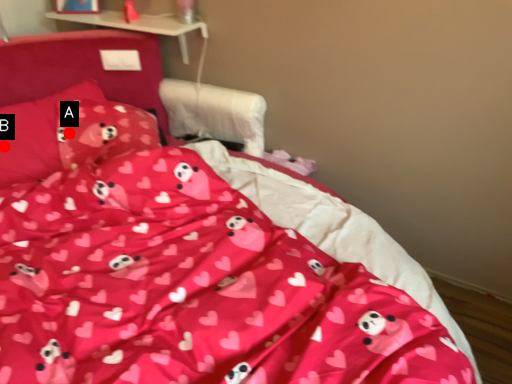
Question: Two points are circled on the image, labeled by A and B beside each circle. Among these points, which one is farthest from the camera?

Choices:
 (A) A is further
 (B) B is further

Answer: (A)